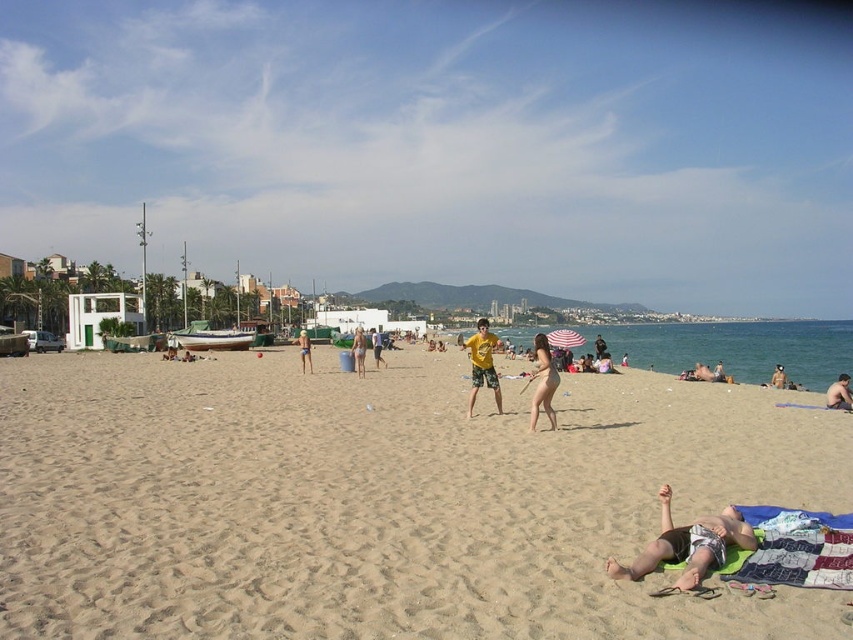
Question: Is transparent blue sky at upper center bigger than nude skin at center?

Choices:
 (A) no
 (B) yes

Answer: (B)

Question: Is nude skin at center positioned in front of tan skin person at center?

Choices:
 (A) no
 (B) yes

Answer: (B)

Question: Which object is positioned closest to the tan skin person at center?

Choices:
 (A) tan skin person at lower right
 (B) matte yellow t-shirt at center
 (C) smooth tan skin at center

Answer: (B)

Question: Does sandy beach at center have a lesser width compared to tan skin person at center?

Choices:
 (A) yes
 (B) no

Answer: (B)

Question: Which object is closer to the camera taking this photo?

Choices:
 (A) tan skin person at center
 (B) tan skin person at lower right
 (C) nude skin at center

Answer: (B)

Question: Which object is closer to the camera taking this photo?

Choices:
 (A) transparent blue sky at upper center
 (B) nude skin at center
 (C) tan skin person at lower right
 (D) light blue swimsuit at center

Answer: (C)